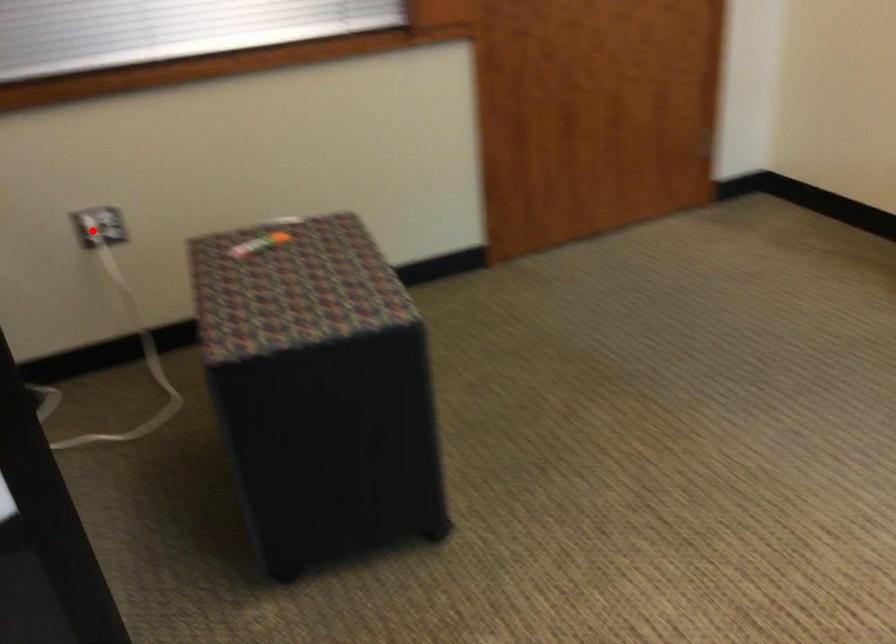
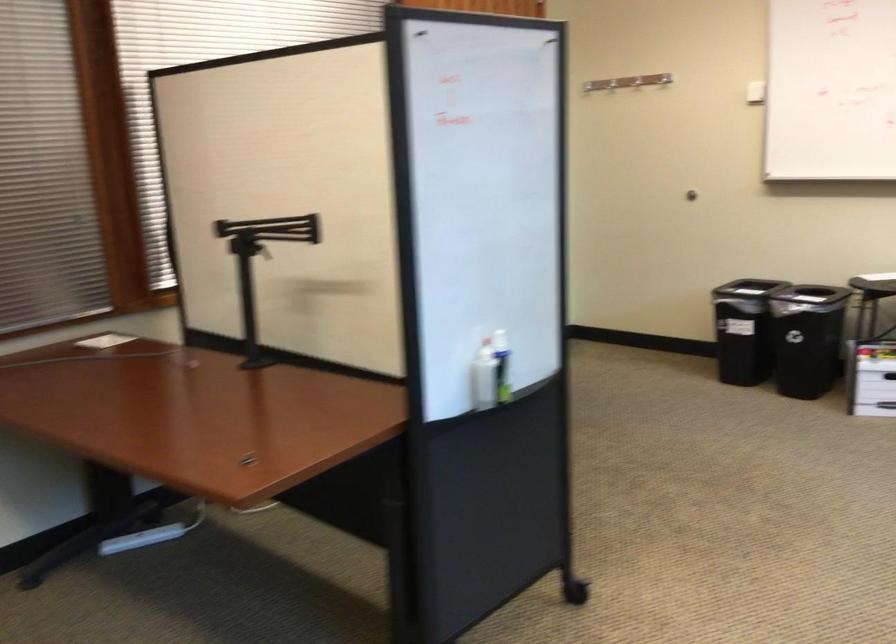
Question: I am providing you with two images of the same scene from different viewpoints. A red point is marked on the first image. Is the red point's position out of view in image 2?

Choices:
 (A) Yes
 (B) No

Answer: (A)